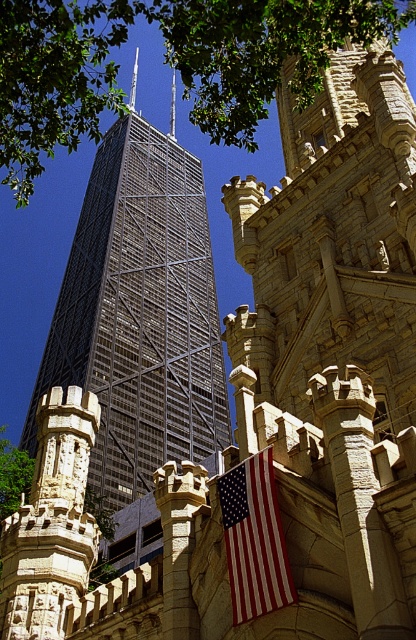
You are a drone operator trying to capture a photo of the historic stone structure on the right. Your drone is currently hovering at the center of the image. The metallic glass skyscraper at center is blocking your view. To avoid collision, you need to move your drone either left or right. Which direction should you move to get a clear shot of the historic stone structure on the right without hitting the skyscraper?

Since the metallic glass skyscraper at center is located at point (x=140, y=314), which is very close to the center of the image, moving the drone slightly to the right would allow it to bypass the skyscraper and capture the historic stone structure on the right while avoiding collision.

You are standing at the base of the skyscraper and want to take a photo of the green leafy tree at upper left. The camera you have can focus on objects up to 100 feet away. Will the tree be in focus?

The green leafy tree at upper left is 89.04 feet away from the viewer. Since the camera can focus up to 100 feet, the tree will be within the focus range and should be in focus.